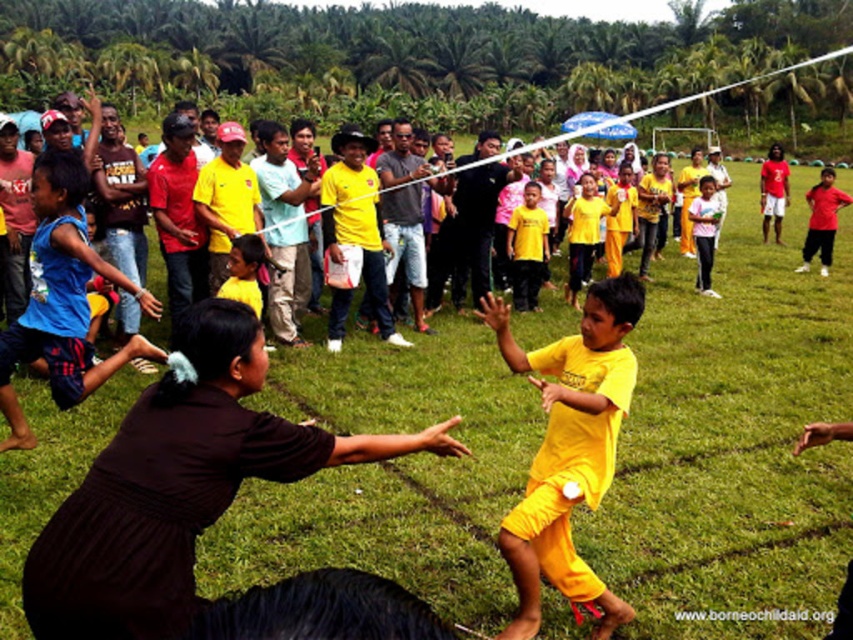
Is brown matte dress at center taller than red matte shirt at upper right?

No, brown matte dress at center is not taller than red matte shirt at upper right.

From the picture: Does brown matte dress at center have a greater width compared to red matte shirt at upper right?

Incorrect, brown matte dress at center's width does not surpass red matte shirt at upper right's.

Does point (79, 632) come in front of point (833, 179)?

Yes, point (79, 632) is in front of point (833, 179).

At what (x,y) coordinates should I click in order to perform the action: click on brown matte dress at center. Please return your answer as a coordinate pair (x, y). Looking at the image, I should click on (178, 484).

Which is above, yellow matte shorts at center or matte black shirt at right?

matte black shirt at right is above.

Is yellow matte shorts at center shorter than matte black shirt at right?

Yes, yellow matte shorts at center is shorter than matte black shirt at right.

This screenshot has height=640, width=853. I want to click on yellow matte shorts at center, so click(569, 449).

From the picture: Which of these two, yellow matte shorts at center or blue fabric shorts at left, stands shorter?

yellow matte shorts at center

Who is more forward, (612, 321) or (3, 369)?

Point (612, 321) is in front.

Is point (621, 301) closer to viewer compared to point (74, 337)?

Yes, it is.

At what (x,y) coordinates should I click in order to perform the action: click on yellow matte shorts at center. Please return your answer as a coordinate pair (x, y). Looking at the image, I should click on (569, 449).